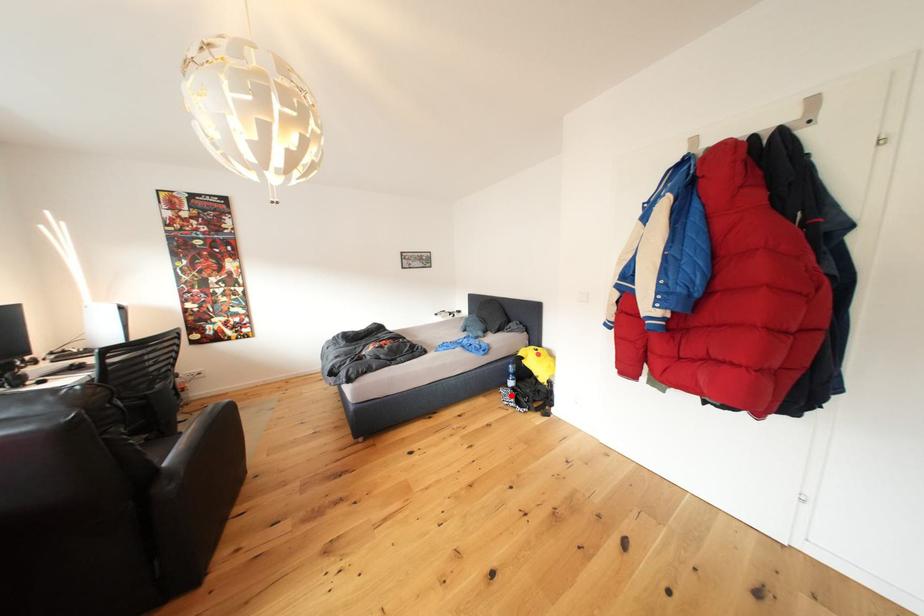
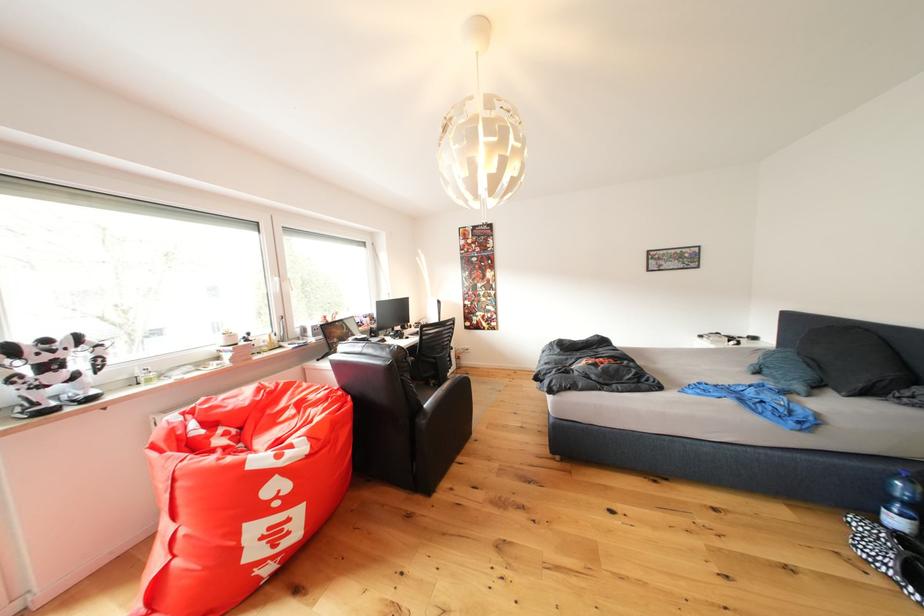
Find the pixel in the second image that matches the highlighted location in the first image.

(864, 527)